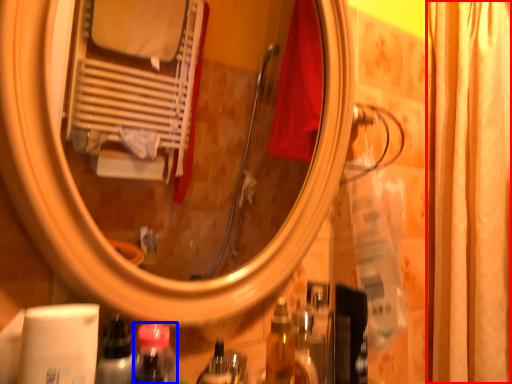
Question: Which point is further to the camera, shower curtain (highlighted by a red box) or mouthwash (highlighted by a blue box)?

Choices:
 (A) shower curtain
 (B) mouthwash

Answer: (A)